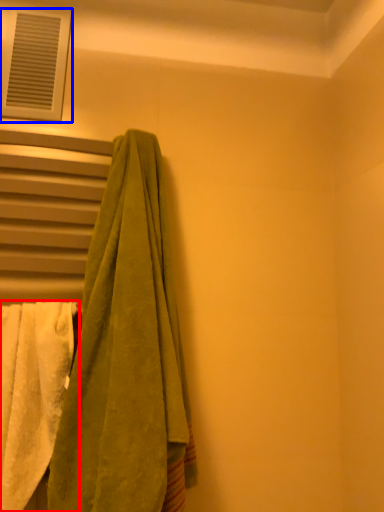
Question: Which object is further to the camera taking this photo, towel (highlighted by a red box) or window (highlighted by a blue box)?

Choices:
 (A) towel
 (B) window

Answer: (B)